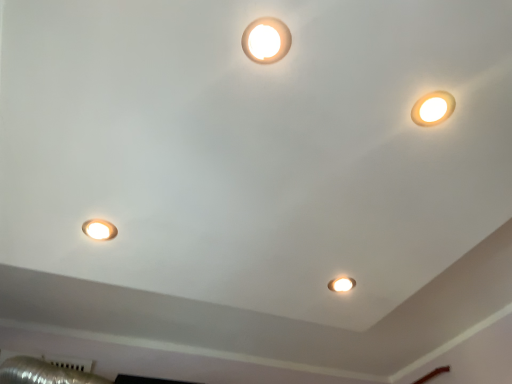
Question: Can you confirm if matte white spotlight at center is positioned to the right of matte white lamp at lower left, the first lamp when ordered from back to front?

Choices:
 (A) yes
 (B) no

Answer: (A)

Question: From the image's perspective, would you say matte white spotlight at center is positioned over matte white lamp at lower left, the first lamp when ordered from back to front?

Choices:
 (A) no
 (B) yes

Answer: (A)

Question: Could you tell me if matte white spotlight at center is facing matte white lamp at lower left, placed as the 3th lamp when sorted from right to left?

Choices:
 (A) yes
 (B) no

Answer: (A)

Question: Could matte white lamp at lower left, the first lamp when ordered from bottom to top, be considered to be inside matte white spotlight at center?

Choices:
 (A) yes
 (B) no

Answer: (B)

Question: From a real-world perspective, is matte white spotlight at center positioned over matte white lamp at lower left, placed as the 3th lamp when sorted from right to left, based on gravity?

Choices:
 (A) yes
 (B) no

Answer: (A)

Question: From a real-world perspective, is matte white spotlight at center located beneath matte white lamp at lower left, positioned as the 3th lamp in top-to-bottom order?

Choices:
 (A) yes
 (B) no

Answer: (B)

Question: From a real-world perspective, is matte white light fixture at upper center, which appears as the 2th lamp when viewed from the right, beneath matte white spotlight at center?

Choices:
 (A) no
 (B) yes

Answer: (B)

Question: Does matte white light fixture at upper center, acting as the 3th lamp starting from the bottom, turn towards matte white spotlight at center?

Choices:
 (A) yes
 (B) no

Answer: (B)

Question: Does matte white light fixture at upper center, positioned as the 3th lamp in back-to-front order, have a greater width compared to matte white spotlight at center?

Choices:
 (A) no
 (B) yes

Answer: (B)

Question: Is matte white light fixture at upper center, which appears as the 2th lamp when viewed from the right, bigger than matte white spotlight at center?

Choices:
 (A) no
 (B) yes

Answer: (B)

Question: Is matte white light fixture at upper center, which appears as the first lamp when viewed from the top, completely or partially outside of matte white spotlight at center?

Choices:
 (A) no
 (B) yes

Answer: (B)

Question: Is matte white light fixture at upper center, which appears as the first lamp when viewed from the top, thinner than matte white spotlight at center?

Choices:
 (A) no
 (B) yes

Answer: (A)

Question: Considering the relative sizes of matte white lamp at upper right, which ranks as the second lamp in top-to-bottom order, and matte white spotlight at center in the image provided, is matte white lamp at upper right, which ranks as the second lamp in top-to-bottom order, smaller than matte white spotlight at center?

Choices:
 (A) no
 (B) yes

Answer: (B)